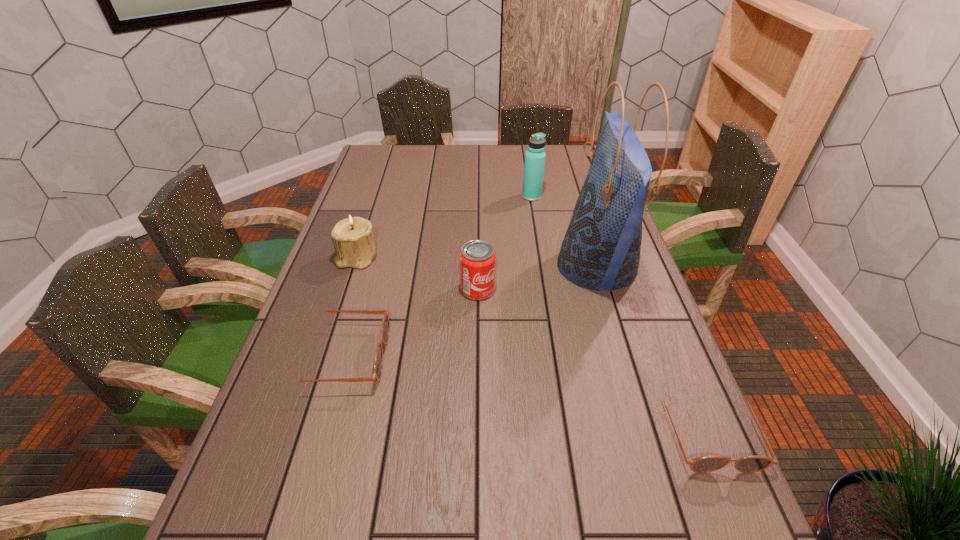
The width and height of the screenshot is (960, 540). What are the coordinates of `empty space that is in between the fifth tallest object and the shopping bag` in the screenshot? It's located at (469, 312).

Locate an element on the screen. The height and width of the screenshot is (540, 960). vacant area that lies between the shortest object and the candle_holder is located at coordinates (533, 344).

The image size is (960, 540). What are the coordinates of `empty space between the thermos bottle and the second shortest object` in the screenshot? It's located at (437, 276).

Locate an element on the screen. vacant space that is in between the second shortest object and the right sunglasses is located at coordinates (525, 394).

Where is `empty location between the right sunglasses and the fourth object from right to left`? empty location between the right sunglasses and the fourth object from right to left is located at coordinates (593, 360).

This screenshot has width=960, height=540. Find the location of `object identified as the second closest to the tallest object`. object identified as the second closest to the tallest object is located at coordinates (477, 259).

Select which object is the second closest to the shopping bag. Please provide its 2D coordinates. Your answer should be formatted as a tuple, i.e. [(x, y)], where the tuple contains the x and y coordinates of a point satisfying the conditions above.

[(477, 259)]

Locate an element on the screen. vacant space that satisfies the following two spatial constraints: 1. on the back side of the fifth shortest object; 2. on the right side of the candle_holder is located at coordinates (377, 197).

Identify the location of vacant region that satisfies the following two spatial constraints: 1. on the front side of the tallest object; 2. on the front-facing side of the second shortest object. The height and width of the screenshot is (540, 960). (624, 356).

This screenshot has width=960, height=540. Identify the location of free spot that satisfies the following two spatial constraints: 1. on the back side of the farthest object; 2. on the right side of the third object from left to right. (478, 197).